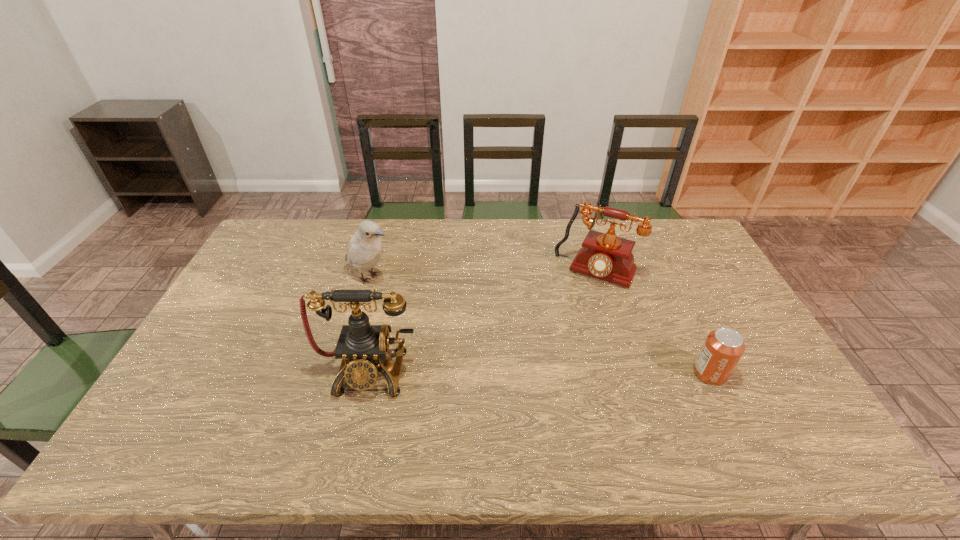
Locate an element on the screen. free space at the far left corner of the desktop is located at coordinates (277, 256).

Identify the location of vacant area between the right telephone and the bird. The height and width of the screenshot is (540, 960). (483, 274).

What are the coordinates of `unoccupied position between the can and the nearer telephone` in the screenshot? It's located at (539, 372).

This screenshot has width=960, height=540. I want to click on free space between the shorter telephone and the nearer telephone, so click(482, 321).

Find the location of a particular element. Image resolution: width=960 pixels, height=540 pixels. vacant space that is in between the nearer telephone and the third object from left to right is located at coordinates (482, 321).

Identify the location of free space that is in between the farther telephone and the can. (653, 323).

Find the location of a particular element. The height and width of the screenshot is (540, 960). vacant point located between the left telephone and the right telephone is located at coordinates (482, 321).

Identify which object is located as the nearest to the bird. Please provide its 2D coordinates. Your answer should be formatted as a tuple, i.e. [(x, y)], where the tuple contains the x and y coordinates of a point satisfying the conditions above.

[(362, 347)]

Point out which object is positioned as the third nearest to the left telephone. Please provide its 2D coordinates. Your answer should be formatted as a tuple, i.e. [(x, y)], where the tuple contains the x and y coordinates of a point satisfying the conditions above.

[(723, 348)]

This screenshot has width=960, height=540. What are the coordinates of `free location that satisfies the following two spatial constraints: 1. on the back side of the bird; 2. on the left side of the shorter telephone` in the screenshot? It's located at (372, 272).